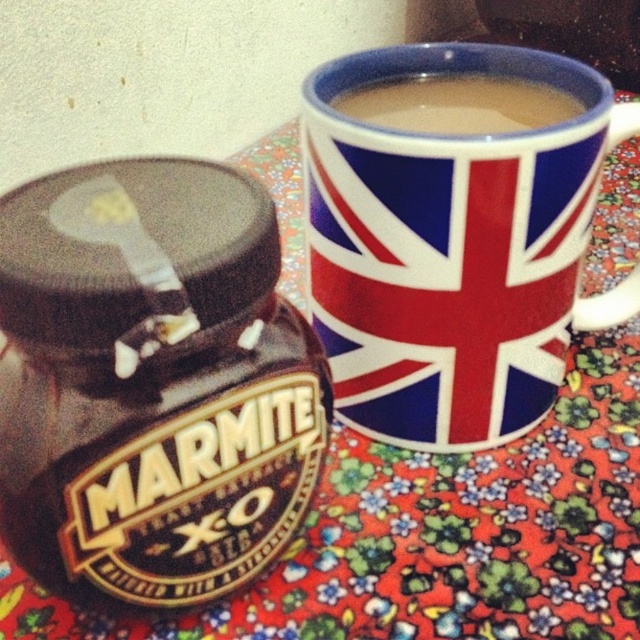
Can you confirm if union jack ceramic mug at upper center is thinner than smooth ceramic mug at upper center?

No.

Is union jack ceramic mug at upper center in front of smooth ceramic mug at upper center?

Yes, it is.

Is point (481, 237) positioned behind point (451, 120)?

No, it is not.

You are a GUI agent. You are given a task and a screenshot of the screen. Output one action in this format:
    pyautogui.click(x=<x>, y=<y>)
    Task: Click on the union jack ceramic mug at upper center
    
    Given the screenshot: What is the action you would take?
    [452, 250]

Between shiny brown marmite jar at left and smooth ceramic mug at upper center, which one is positioned higher?

smooth ceramic mug at upper center is higher up.

Looking at this image, can you confirm if shiny brown marmite jar at left is positioned below smooth ceramic mug at upper center?

Correct, shiny brown marmite jar at left is located below smooth ceramic mug at upper center.

The image size is (640, 640). Describe the element at coordinates (150, 385) in the screenshot. I see `shiny brown marmite jar at left` at that location.

What are the coordinates of `shiny brown marmite jar at left` in the screenshot? It's located at (150, 385).

Does shiny brown marmite jar at left lie in front of union jack ceramic mug at upper center?

That is True.

Who is more forward, (67, 333) or (340, 86)?

Point (67, 333)

From the picture: Who is more distant from viewer, (292, 410) or (417, 349)?

Positioned behind is point (417, 349).

Where is `shiny brown marmite jar at left`? shiny brown marmite jar at left is located at coordinates pyautogui.click(x=150, y=385).